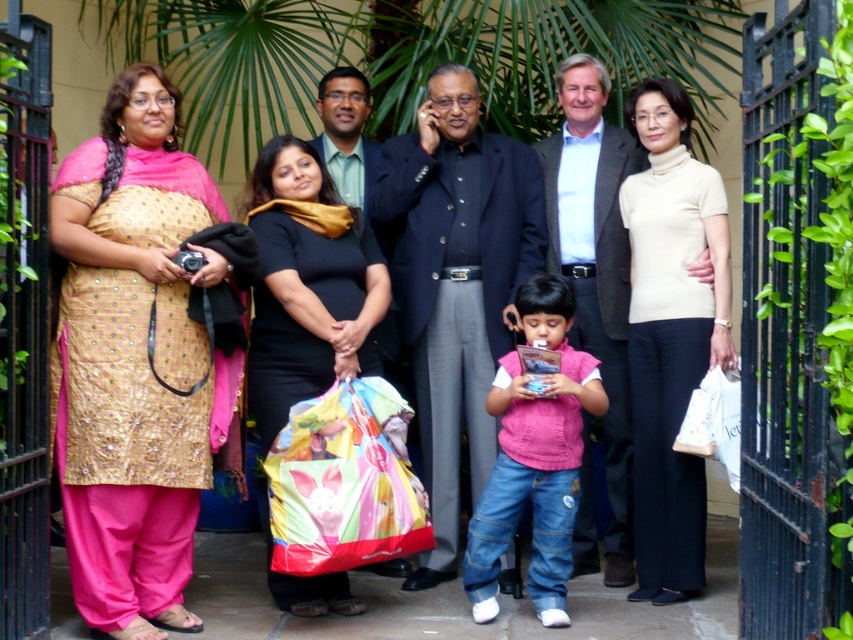
Does gold sequined kurta at left have a lesser height compared to pink knitted vest at center?

Incorrect, gold sequined kurta at left's height does not fall short of pink knitted vest at center's.

I want to click on gold sequined kurta at left, so [134, 362].

You are a GUI agent. You are given a task and a screenshot of the screen. Output one action in this format:
    pyautogui.click(x=<x>, y=<y>)
    Task: Click on the gold sequined kurta at left
    The image size is (853, 640).
    Given the screenshot: What is the action you would take?
    pyautogui.click(x=134, y=362)

From the picture: Who is more forward, (94, 224) or (664, 561)?

Point (94, 224) is in front.

In the scene shown: Can you confirm if gold sequined kurta at left is wider than beige turtleneck sweater at center?

Indeed, gold sequined kurta at left has a greater width compared to beige turtleneck sweater at center.

Image resolution: width=853 pixels, height=640 pixels. I want to click on gold sequined kurta at left, so click(x=134, y=362).

Does pink knitted vest at center appear on the left side of multicolored plastic bag at center?

No, pink knitted vest at center is not to the left of multicolored plastic bag at center.

Consider the image. Is pink knitted vest at center taller than multicolored plastic bag at center?

Correct, pink knitted vest at center is much taller as multicolored plastic bag at center.

In order to click on pink knitted vest at center in this screenshot , I will do `click(534, 456)`.